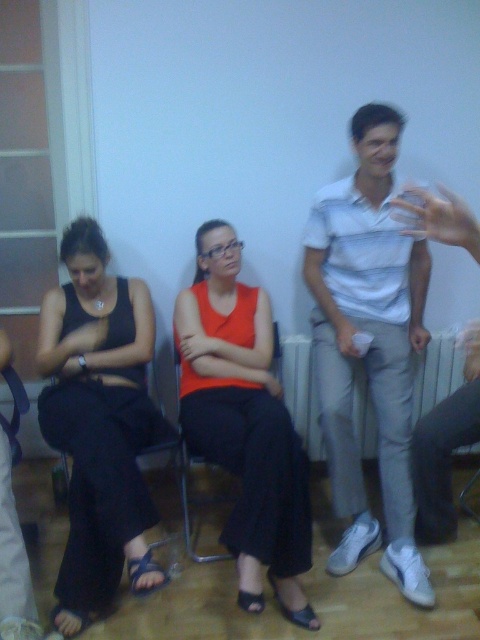
Between matte orange tank top at center and white cotton shirt at center, which one appears on the right side from the viewer's perspective?

Positioned to the right is white cotton shirt at center.

From the picture: Is matte orange tank top at center positioned at the back of white cotton shirt at center?

That is False.

Does point (264, 547) come farther from viewer compared to point (470, 385)?

No, (264, 547) is closer to viewer.

Locate an element on the screen. matte orange tank top at center is located at coordinates (x=243, y=422).

Does white striped shirt at center appear on the right side of black fabric dress at left?

Yes, white striped shirt at center is to the right of black fabric dress at left.

Which is more to the right, white striped shirt at center or black fabric dress at left?

white striped shirt at center is more to the right.

Does point (339, 394) lie behind point (76, 564)?

Yes, it is behind point (76, 564).

The height and width of the screenshot is (640, 480). In order to click on white striped shirt at center in this screenshot , I will do `click(370, 344)`.

Between white striped shirt at center and metallic silver chair at center, which one has less height?

metallic silver chair at center

Is point (373, 387) farther from camera compared to point (183, 515)?

No, (373, 387) is in front of (183, 515).

Describe the element at coordinates (370, 344) in the screenshot. The height and width of the screenshot is (640, 480). I see `white striped shirt at center` at that location.

You are a GUI agent. You are given a task and a screenshot of the screen. Output one action in this format:
    pyautogui.click(x=<x>, y=<y>)
    Task: Click on the white striped shirt at center
    The width and height of the screenshot is (480, 640).
    Given the screenshot: What is the action you would take?
    pyautogui.click(x=370, y=344)